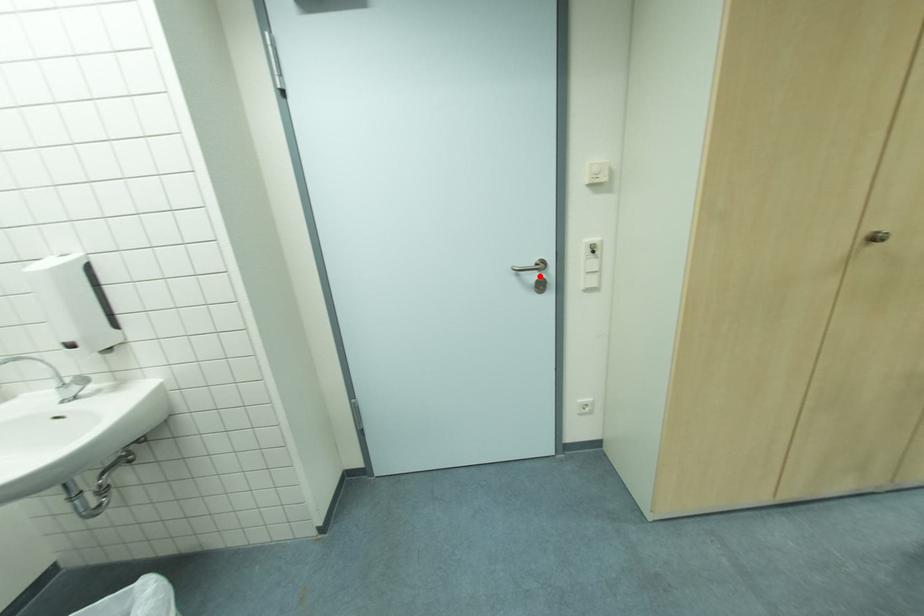
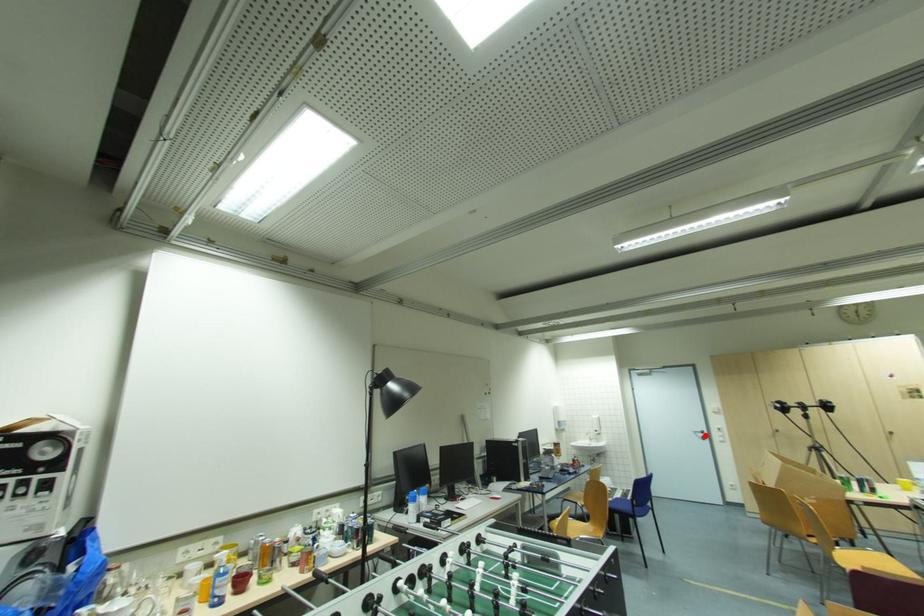
I am providing you with two images of the same scene from different viewpoints. A red point is marked on the first image and another point is marked on the second image. Do the highlighted points in image1 and image2 indicate the same real-world spot?

Yes